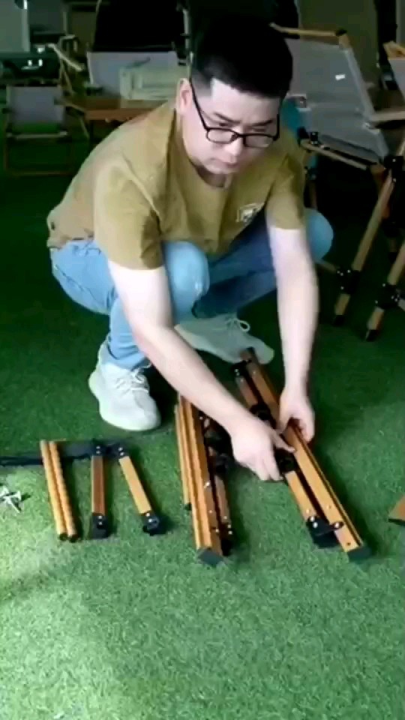
Locate an element on the screen. The image size is (405, 720). black computer chair is located at coordinates (136, 6).